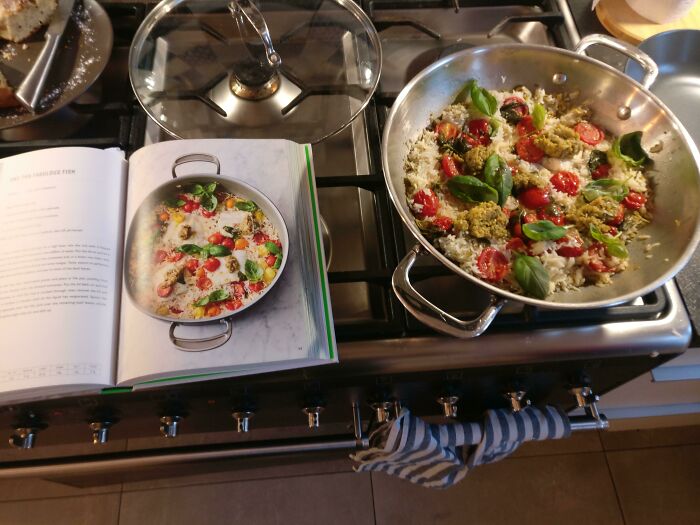
The image size is (700, 525). In order to click on stove in this screenshot , I will do `click(374, 354)`, `click(447, 20)`, `click(402, 21)`, `click(208, 401)`, `click(203, 466)`, `click(206, 452)`.